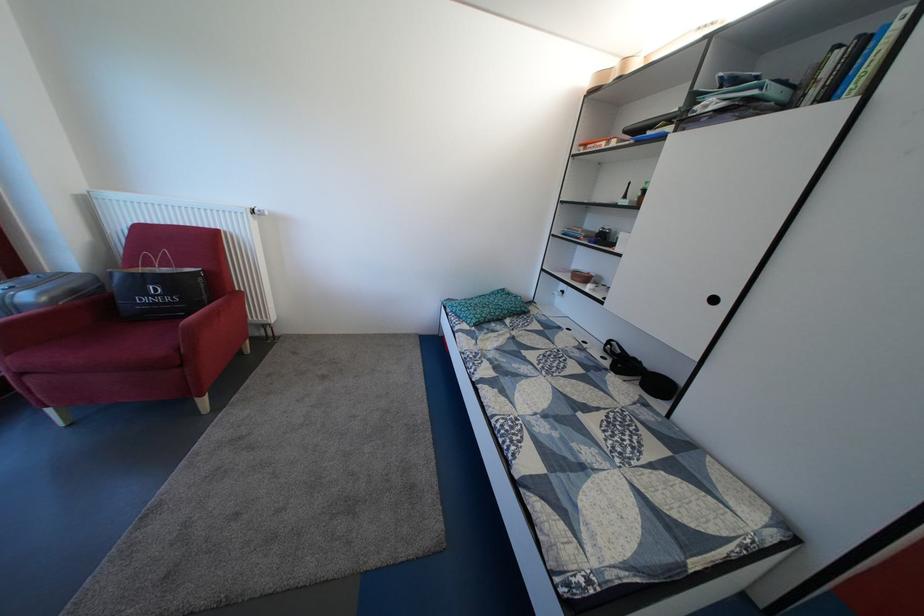
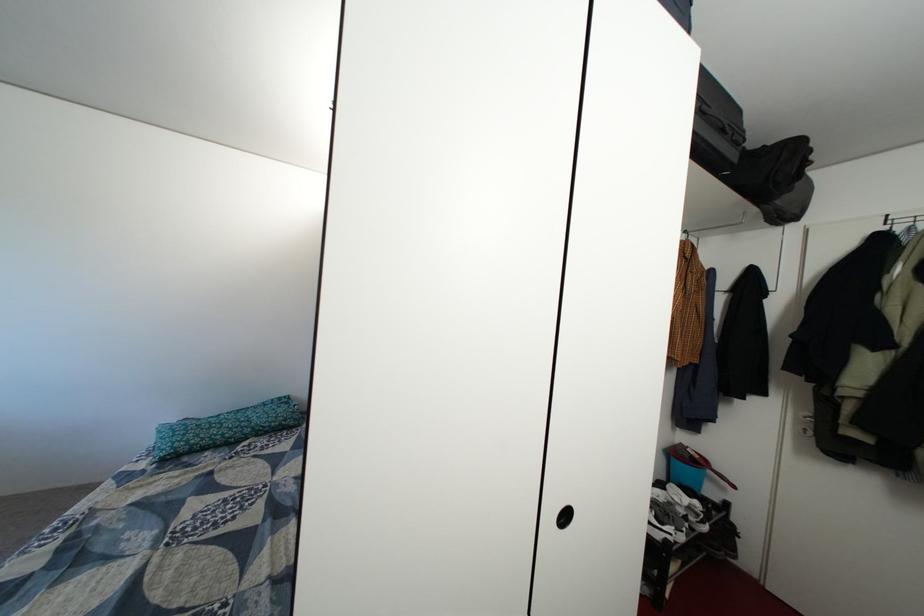
Question: I am providing you with two images of the same scene from different viewpoints. Please identify which objects are invisible in image2.

Choices:
 (A) recessed cabinet handle
 (B) green floral pillow
 (C) black lamp shade
 (D) black suitcase

Answer: (A)